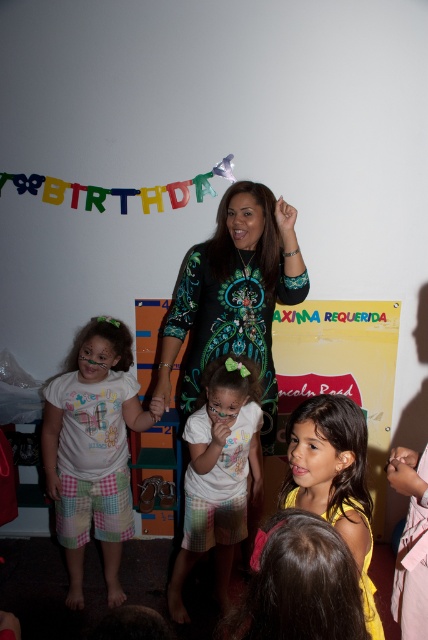
Question: Which object appears closest to the camera in this image?

Choices:
 (A) printed fabric dress at center
 (B) yellow fabric dress at center

Answer: (B)

Question: Can you confirm if white cotton shirt at center is bigger than yellow fabric dress at center?

Choices:
 (A) yes
 (B) no

Answer: (A)

Question: Which of the following is the closest to the observer?

Choices:
 (A) (196, 518)
 (B) (79, 522)
 (C) (359, 564)
 (D) (296, 282)

Answer: (C)

Question: Is printed fabric dress at center above white cotton shirt at center?

Choices:
 (A) no
 (B) yes

Answer: (B)

Question: Which of the following is the closest to the observer?

Choices:
 (A) (171, 612)
 (B) (79, 550)
 (C) (220, 250)

Answer: (C)

Question: Does white cotton shirt at left lie behind yellow fabric dress at center?

Choices:
 (A) no
 (B) yes

Answer: (B)